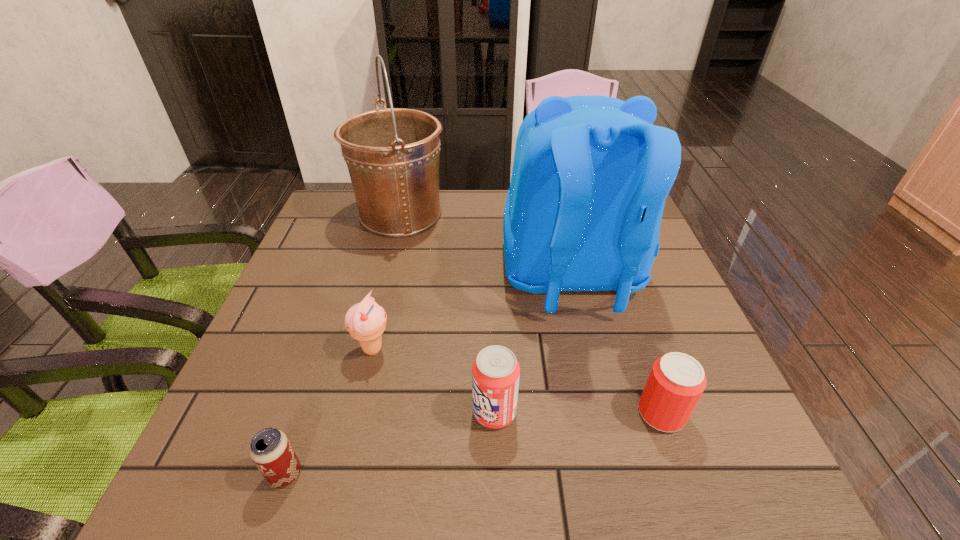
Find the location of a particular element. This screenshot has height=540, width=960. vacant area that lies between the bucket and the backpack is located at coordinates (486, 245).

I want to click on free space between the soda can and the backpack, so click(x=533, y=344).

Where is `empty location between the bucket and the taller beer can`? empty location between the bucket and the taller beer can is located at coordinates (531, 314).

The width and height of the screenshot is (960, 540). Identify the location of vacant area that lies between the fourth nearest object and the shorter beer can. (328, 411).

Identify the location of unoccupied area between the bucket and the icecream. This screenshot has width=960, height=540. (387, 282).

Image resolution: width=960 pixels, height=540 pixels. Identify the location of vacant space that is in between the backpack and the bucket. (486, 245).

You are a GUI agent. You are given a task and a screenshot of the screen. Output one action in this format:
    pyautogui.click(x=<x>, y=<y>)
    Task: Click on the unoccupied area between the backpack and the nearer beer can
    
    Given the screenshot: What is the action you would take?
    pyautogui.click(x=428, y=375)

Find the location of a particular element. The image size is (960, 540). vacant point located between the icecream and the bucket is located at coordinates (387, 282).

Where is `unoccupied position between the bucket and the nearest object`? unoccupied position between the bucket and the nearest object is located at coordinates [x=343, y=344].

What are the coordinates of `object that ranks as the fifth closest to the backpack` in the screenshot? It's located at (270, 449).